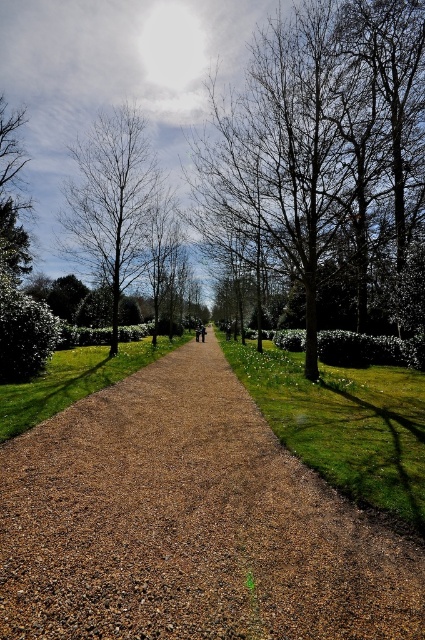
You are standing at the start of the gravel path and want to walk towards the distant trees. Which direction should you go to stay on the brown gravel path at center while avoiding the brown leafless tree at center?

The brown gravel path at center is to the left of the brown leafless tree at center, so you should walk to the left of the tree to stay on the path.

You are a gardener planning to install a new sprinkler system along the brown gravel path at center and the brown leafless tree at upper left. Which area requires a larger sprinkler head based on their sizes?

The brown gravel path at center requires a larger sprinkler head because it is bigger than the brown leafless tree at upper left.